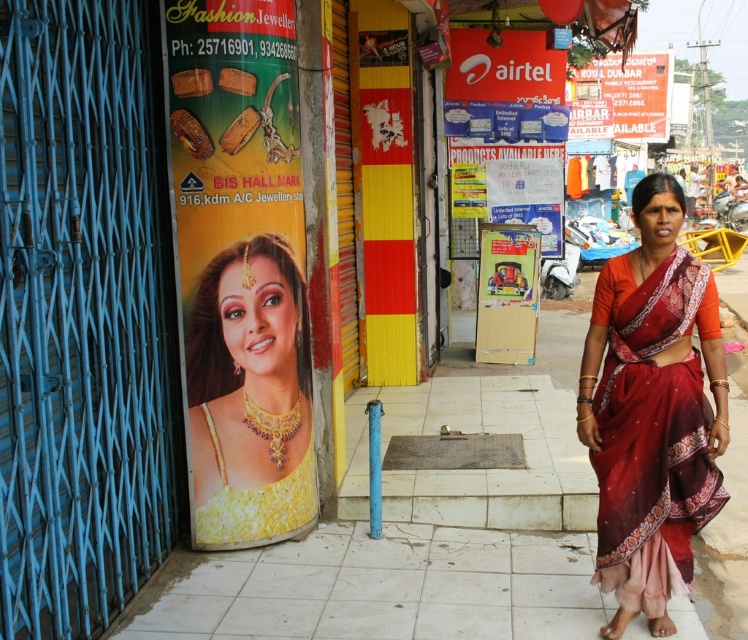
Is point (212, 234) behind point (260, 531)?

No, (212, 234) is closer to viewer.

The width and height of the screenshot is (748, 640). What do you see at coordinates (242, 268) in the screenshot?
I see `yellow fabric poster at left` at bounding box center [242, 268].

Where is `yellow fabric poster at left`? The width and height of the screenshot is (748, 640). yellow fabric poster at left is located at coordinates (242, 268).

Can you confirm if silky red sari at right is positioned below yellow satin dress at center?

Incorrect, silky red sari at right is not positioned below yellow satin dress at center.

Looking at this image, which is below, silky red sari at right or yellow satin dress at center?

yellow satin dress at center

You are a GUI agent. You are given a task and a screenshot of the screen. Output one action in this format:
    pyautogui.click(x=<x>, y=<y>)
    Task: Click on the silky red sari at right
    
    Given the screenshot: What is the action you would take?
    pyautogui.click(x=652, y=412)

At what (x,y) coordinates should I click in order to perform the action: click on silky red sari at right. Please return your answer as a coordinate pair (x, y). Looking at the image, I should click on (652, 412).

This screenshot has height=640, width=748. Describe the element at coordinates (251, 397) in the screenshot. I see `yellow fabric at center` at that location.

Is point (280, 296) farther from viewer compared to point (292, 500)?

No.

Is point (203, 424) farther from viewer compared to point (220, 468)?

No, it is in front of (220, 468).

Locate an element on the screen. This screenshot has width=748, height=640. yellow fabric at center is located at coordinates (251, 397).